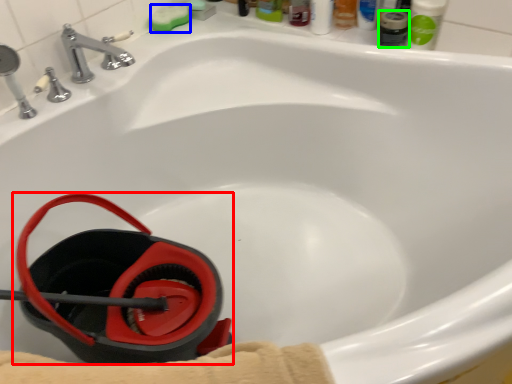
Question: Considering the real-world distances, which object is closest to job (highlighted by a red box)? soap (highlighted by a blue box) or mouthwash (highlighted by a green box).

Choices:
 (A) soap
 (B) mouthwash

Answer: (A)